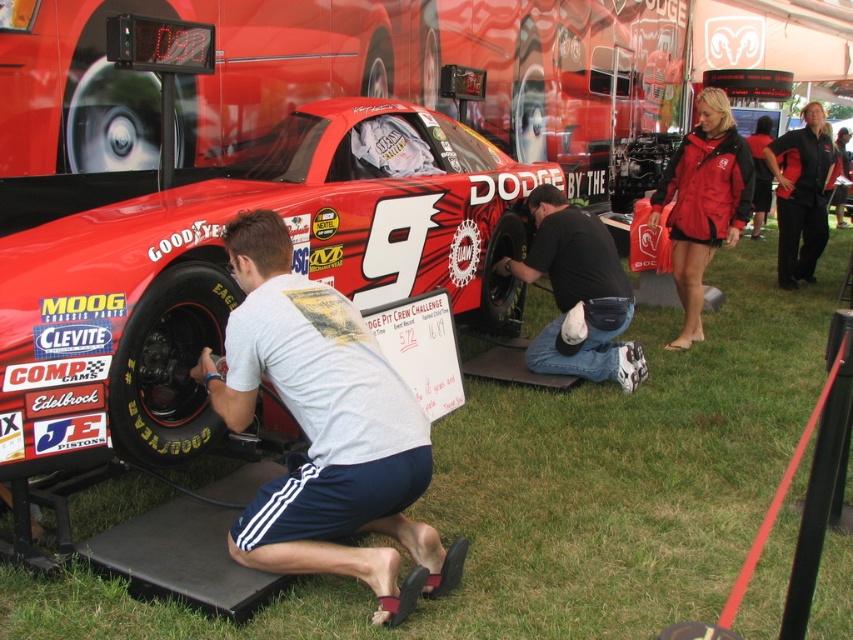
Is point (233, 305) more distant than point (125, 376)?

Yes, it is behind point (125, 376).

I want to click on shiny red car at center, so click(x=228, y=269).

Who is positioned more to the right, black rubber tire at lower left or black fabric pants at lower center?

black fabric pants at lower center

Can you confirm if black rubber tire at lower left is positioned to the right of black fabric pants at lower center?

Incorrect, black rubber tire at lower left is not on the right side of black fabric pants at lower center.

Where is `black rubber tire at lower left`? black rubber tire at lower left is located at coordinates (167, 365).

Where is `black rubber tire at lower left`? This screenshot has width=853, height=640. black rubber tire at lower left is located at coordinates (x=167, y=365).

Is black rubber tire at lower left positioned behind black rubber tire at lower center?

No, black rubber tire at lower left is closer to the viewer.

Identify the location of black rubber tire at lower left. (167, 365).